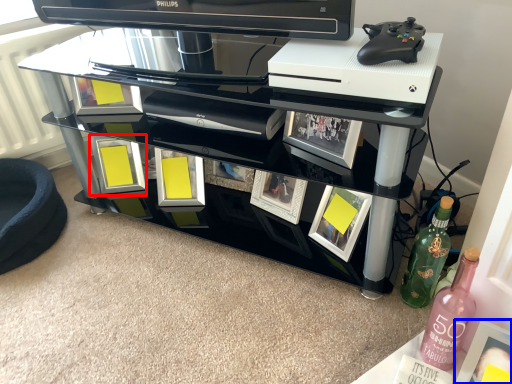
Question: Which object appears farthest to the camera in this image, picture frame (highlighted by a red box) or picture frame (highlighted by a blue box)?

Choices:
 (A) picture frame
 (B) picture frame

Answer: (A)